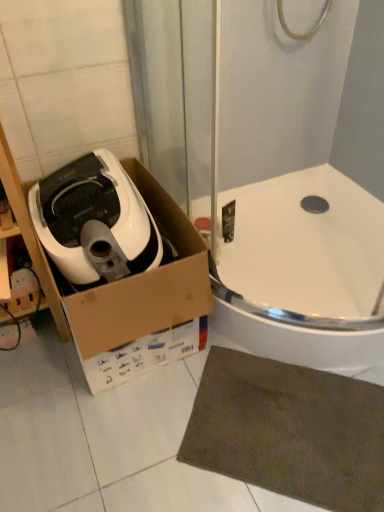
Locate an element on the screen. The image size is (384, 512). vacant space situated above brown textured bath mat at lower right (from a real-world perspective) is located at coordinates (283, 422).